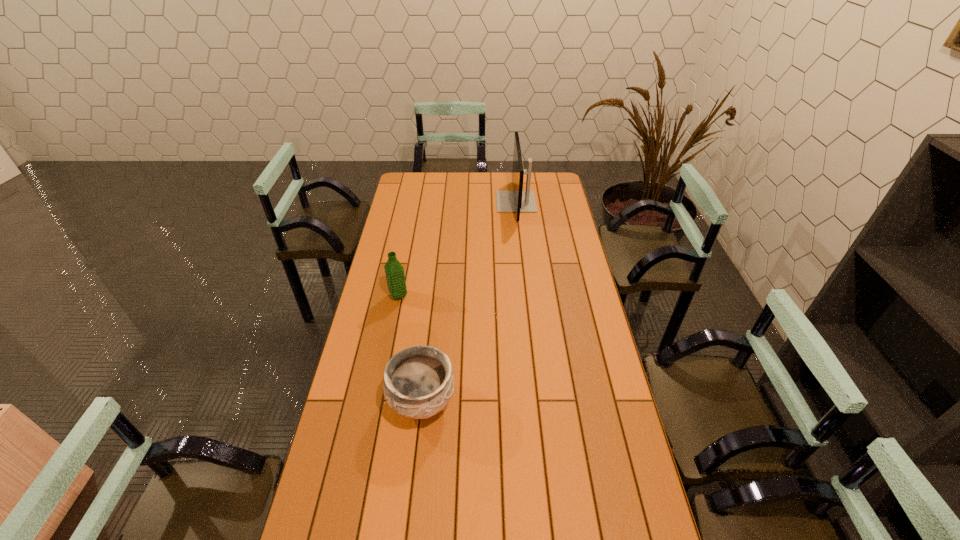
Locate an element on the screen. The height and width of the screenshot is (540, 960). vacant area located on the front of the nearest object is located at coordinates (414, 474).

Locate an element on the screen. The image size is (960, 540). object at the far edge is located at coordinates (517, 200).

Where is `water bottle located at the left edge`? water bottle located at the left edge is located at coordinates pyautogui.click(x=394, y=271).

Locate an element on the screen. The height and width of the screenshot is (540, 960). pottery present at the left edge is located at coordinates (418, 383).

The height and width of the screenshot is (540, 960). In order to click on object located in the right edge section of the desktop in this screenshot , I will do `click(517, 200)`.

The width and height of the screenshot is (960, 540). Find the location of `object that is at the far right corner`. object that is at the far right corner is located at coordinates (517, 200).

Where is `free region at the far edge of the desktop`? The image size is (960, 540). free region at the far edge of the desktop is located at coordinates (471, 180).

In the image, there is a desktop. Where is `vacant space at the left edge`? vacant space at the left edge is located at coordinates (391, 237).

Identify the location of vacant space at the right edge. Image resolution: width=960 pixels, height=540 pixels. (567, 211).

Where is `empty space that is in between the computer monitor and the second tallest object`? The width and height of the screenshot is (960, 540). empty space that is in between the computer monitor and the second tallest object is located at coordinates (457, 249).